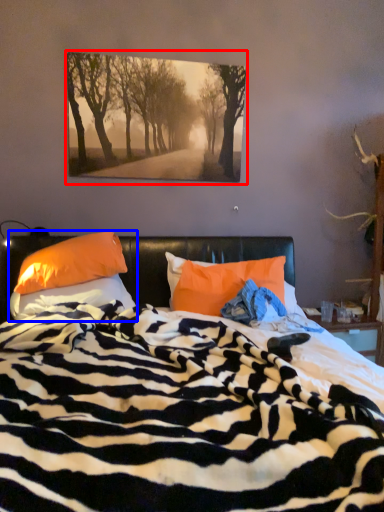
Question: Which object appears farthest to the camera in this image, picture frame (highlighted by a red box) or pillow (highlighted by a blue box)?

Choices:
 (A) picture frame
 (B) pillow

Answer: (A)